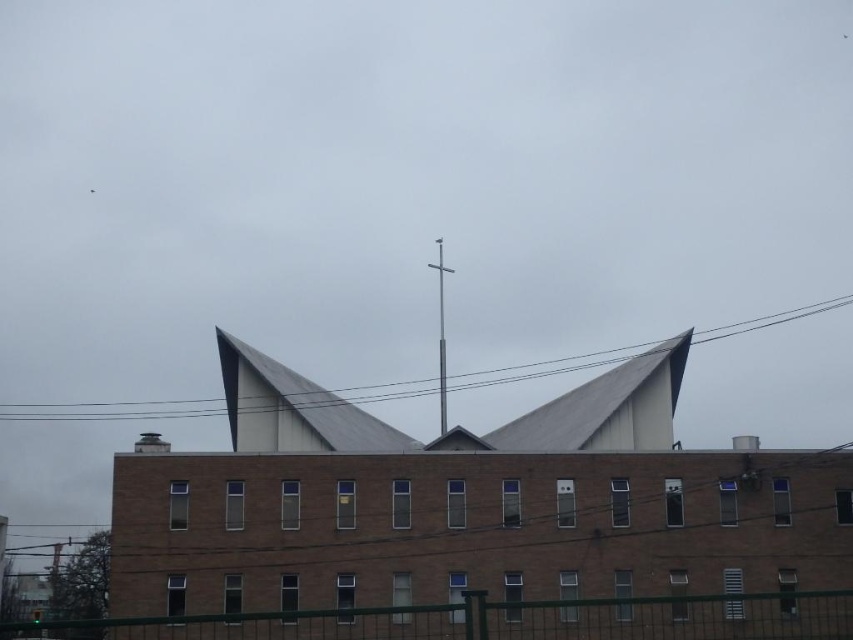
You are a maintenance worker who needs to reach both the black wire at upper center and the silver metallic cross at center on the church roof. Your ladder can extend up to 20 meters. Can you safely reach both objects with your current ladder?

The black wire at upper center and the silver metallic cross at center are 23.61 meters apart from each other. Since the ladder can only extend up to 20 meters, you cannot safely reach both objects with your current ladder.